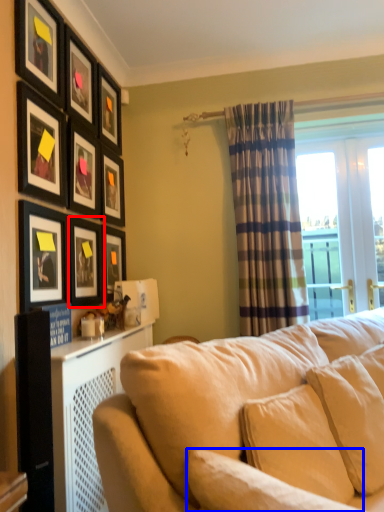
Question: Which object is further to the camera taking this photo, picture frame (highlighted by a red box) or pillow (highlighted by a blue box)?

Choices:
 (A) picture frame
 (B) pillow

Answer: (A)